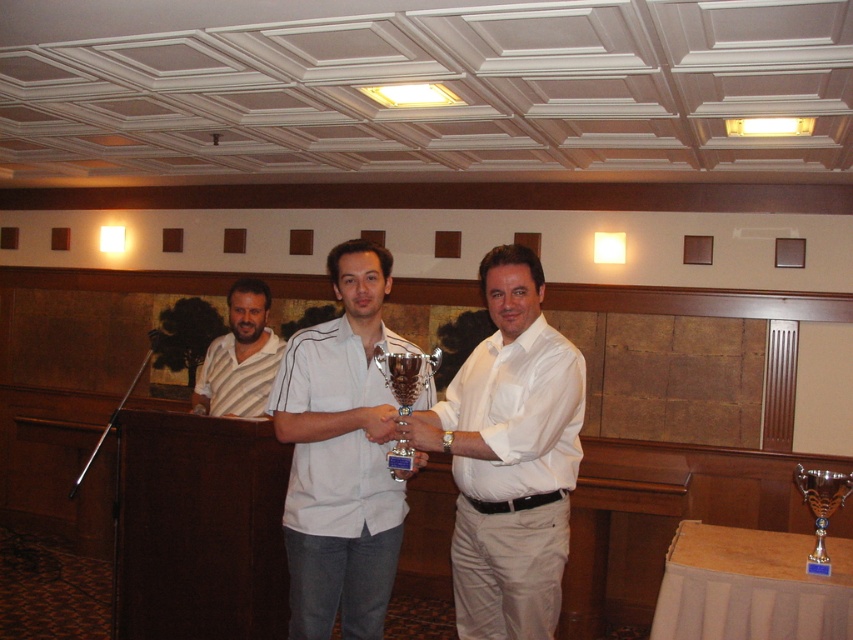
Question: Can you confirm if white matte shirt at center is wider than metallic silver trophy at center?

Choices:
 (A) no
 (B) yes

Answer: (B)

Question: Among these objects, which one is nearest to the camera?

Choices:
 (A) white glossy shirt at center
 (B) metallic silver trophy at center
 (C) white matte shirt at center
 (D) striped cotton shirt at center

Answer: (A)

Question: Estimate the real-world distances between objects in this image. Which object is farther from the white matte shirt at center?

Choices:
 (A) striped cotton shirt at center
 (B) white glossy shirt at center

Answer: (A)

Question: Can you confirm if white matte shirt at center is positioned above metallic silver trophy at center?

Choices:
 (A) yes
 (B) no

Answer: (B)

Question: Estimate the real-world distances between objects in this image. Which object is farther from the silver metallic trophy at lower right?

Choices:
 (A) white matte shirt at center
 (B) striped cotton shirt at center

Answer: (B)

Question: Does white matte shirt at center have a smaller size compared to striped cotton shirt at center?

Choices:
 (A) no
 (B) yes

Answer: (A)